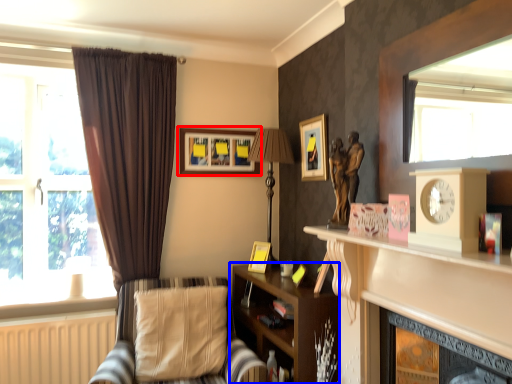
Question: Among these objects, which one is farthest to the camera, picture frame (highlighted by a red box) or shelf (highlighted by a blue box)?

Choices:
 (A) picture frame
 (B) shelf

Answer: (A)